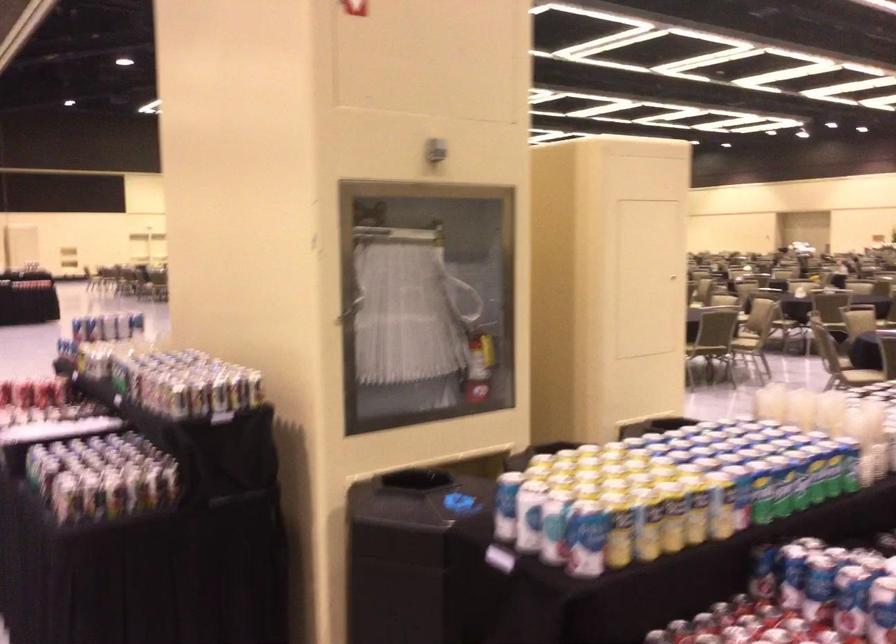
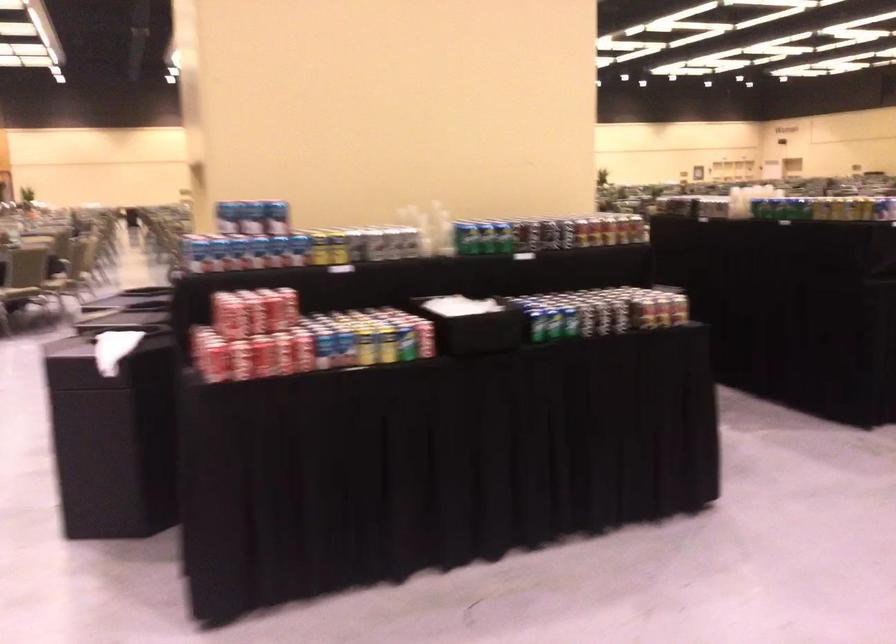
In the second image, find the point that corresponds to (x=152, y=362) in the first image.

(466, 238)